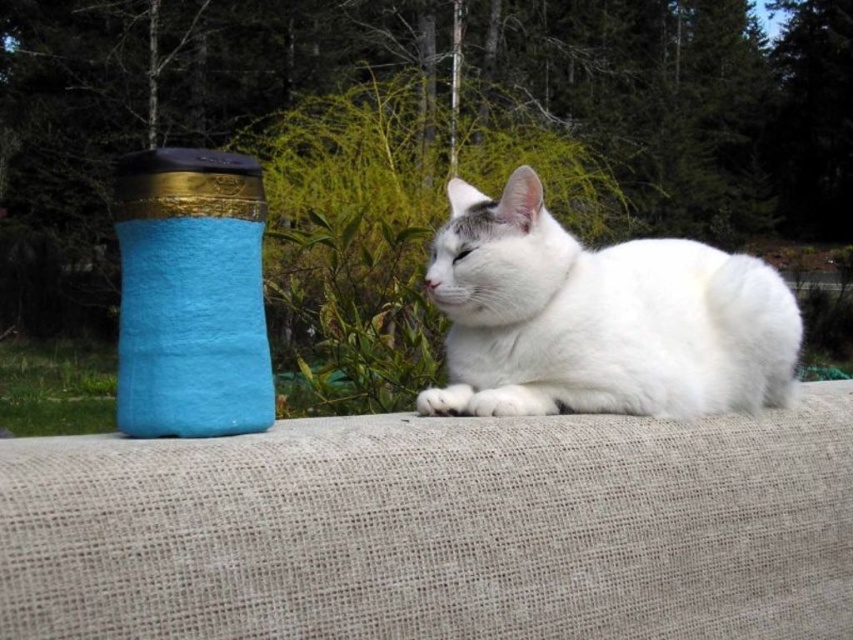
Question: Among these points, which one is nearest to the camera?

Choices:
 (A) (782, 296)
 (B) (502, 515)

Answer: (B)

Question: Where is beige fabric couch at center located in relation to white fluffy cat at center in the image?

Choices:
 (A) left
 (B) right

Answer: (A)

Question: Which point is farther to the camera?

Choices:
 (A) (730, 280)
 (B) (546, 589)

Answer: (A)

Question: Where is beige fabric couch at center located in relation to white fluffy cat at center in the image?

Choices:
 (A) below
 (B) above

Answer: (A)

Question: Can you confirm if beige fabric couch at center is positioned to the left of white fluffy cat at center?

Choices:
 (A) no
 (B) yes

Answer: (B)